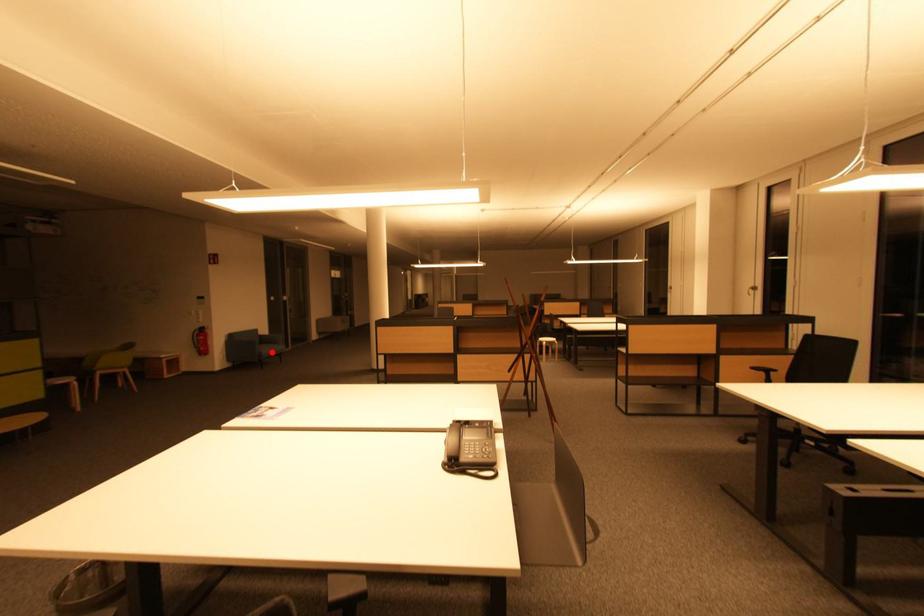
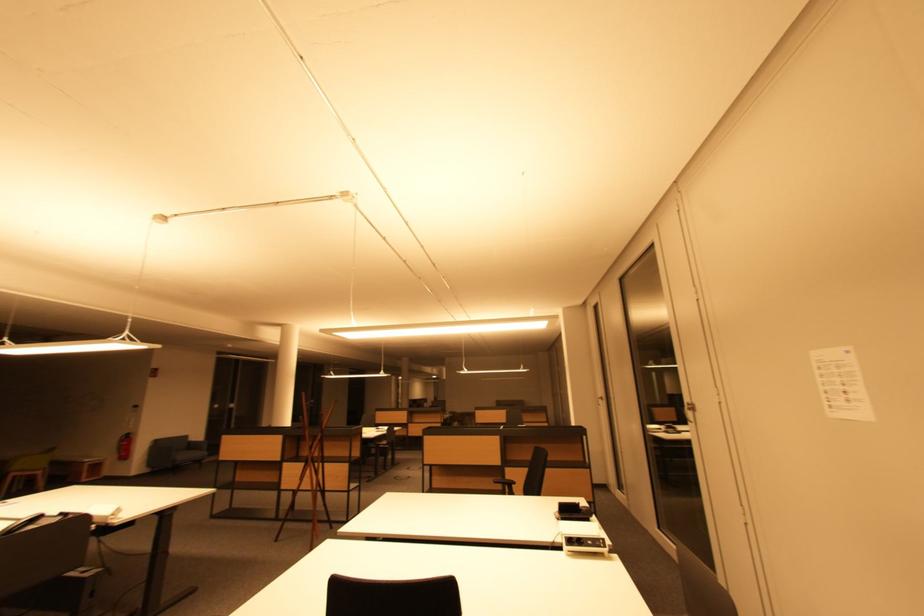
Question: A red point is marked in image1. In image2, is the corresponding 3D point closer to the camera or farther? Reply with the corresponding letter.

Choices:
 (A) The corresponding 3D point is closer.
 (B) The corresponding 3D point is farther.

Answer: (B)